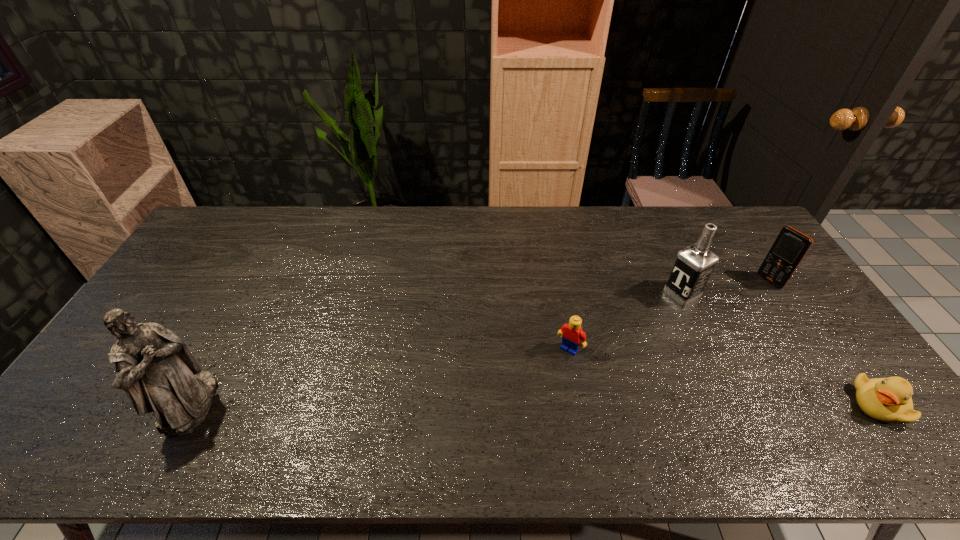
Locate an element on the screen. Image resolution: width=960 pixels, height=540 pixels. figurine is located at coordinates (154, 367).

Find the location of a particular element. This screenshot has height=540, width=960. the tallest object is located at coordinates point(154,367).

At what (x,y) coordinates should I click in order to perform the action: click on duckling. Please return your answer as a coordinate pair (x, y). This screenshot has height=540, width=960. Looking at the image, I should click on (888, 400).

The height and width of the screenshot is (540, 960). I want to click on the third farthest object, so click(x=572, y=335).

Where is `the fourth object from right to left`? This screenshot has width=960, height=540. the fourth object from right to left is located at coordinates (572, 335).

The height and width of the screenshot is (540, 960). Identify the location of the third object from right to left. (693, 267).

I want to click on the second tallest object, so click(x=693, y=267).

This screenshot has height=540, width=960. I want to click on cellular telephone, so click(790, 247).

You are a GUI agent. You are given a task and a screenshot of the screen. Output one action in this format:
    pyautogui.click(x=<x>, y=<y>)
    Task: Click on the free space located 0.120m on the front-facing side of the figurine
    This screenshot has height=540, width=960.
    Given the screenshot: What is the action you would take?
    point(261,403)

Where is `free space located 0.240m on the front-facing side of the duckling`? This screenshot has width=960, height=540. free space located 0.240m on the front-facing side of the duckling is located at coordinates (758, 404).